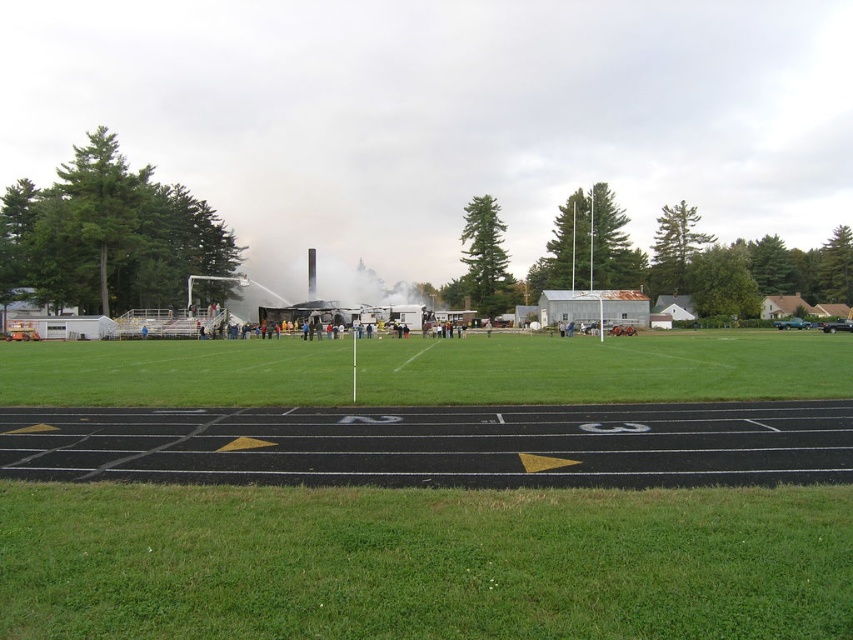
Question: Based on their relative distances, which object is farther from the black asphalt race track at lower center?

Choices:
 (A) green grass at center
 (B) white smoke at center

Answer: (B)

Question: Is green grass at center behind white smoke at center?

Choices:
 (A) no
 (B) yes

Answer: (A)

Question: Which point appears farthest from the camera in this image?

Choices:
 (A) (305, 272)
 (B) (332, 470)
 (C) (670, 392)

Answer: (A)

Question: Which point is closer to the camera?

Choices:
 (A) (440, 307)
 (B) (88, 355)

Answer: (B)

Question: Can you confirm if green grass at center is thinner than white smoke at center?

Choices:
 (A) no
 (B) yes

Answer: (A)

Question: Does green grass at center come behind white smoke at center?

Choices:
 (A) no
 (B) yes

Answer: (A)